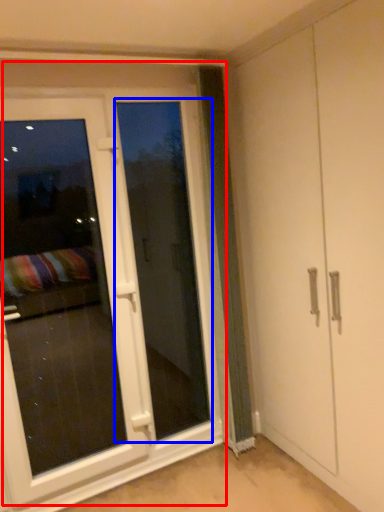
Question: Which point is further to the camera, door (highlighted by a red box) or screen door (highlighted by a blue box)?

Choices:
 (A) door
 (B) screen door

Answer: (B)